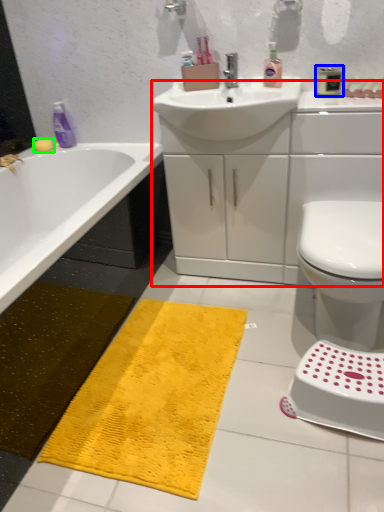
Question: Considering the real-world distances, which object is farthest from counter top (highlighted by a red box)? mouthwash (highlighted by a blue box) or soap (highlighted by a green box)?

Choices:
 (A) mouthwash
 (B) soap

Answer: (B)